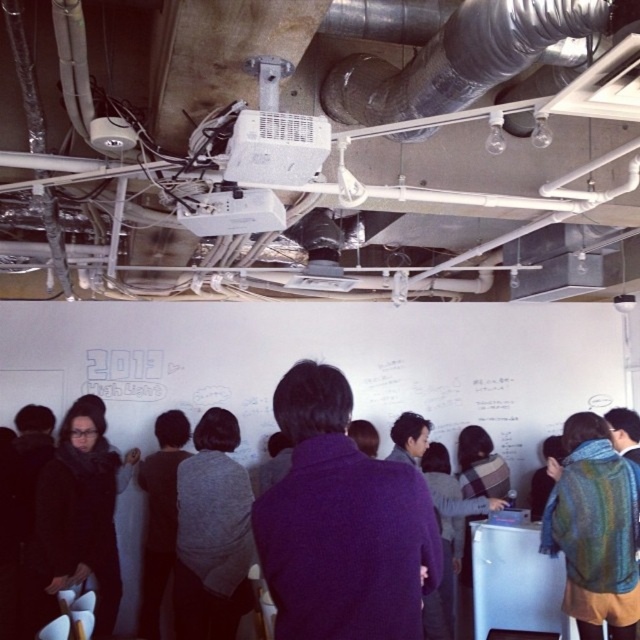
You are an interior designer assessing the space for a new lighting fixture. You notice the purple wool sweater at center and the metallic flexible duct at upper center. Which object is taller? Please consider their heights when planning the installation.

The purple wool sweater at center is taller than the metallic flexible duct at upper center, so the designer should account for its height when installing the lighting fixture.

You are standing in the room and want to place a new sticky note on the whiteboard. The sticky note needs to be placed to the right of the purple wool sweater at center. Can you determine if there is enough space on the whiteboard for the sticky note?

The purple wool sweater at center is located at point (340, 524). Since the whiteboard spans the entire wall, there is sufficient space to the right of the purple wool sweater at center to place the sticky note.